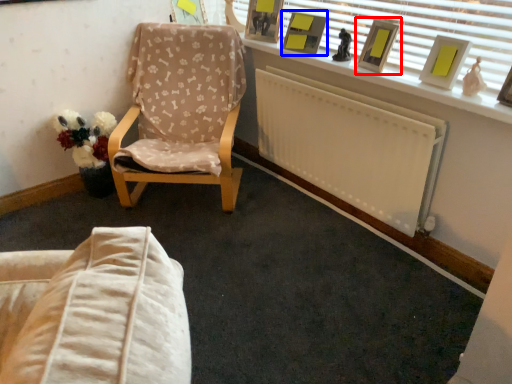
Question: Which of the following is the closest to the observer, picture frame (highlighted by a red box) or picture frame (highlighted by a blue box)?

Choices:
 (A) picture frame
 (B) picture frame

Answer: (A)